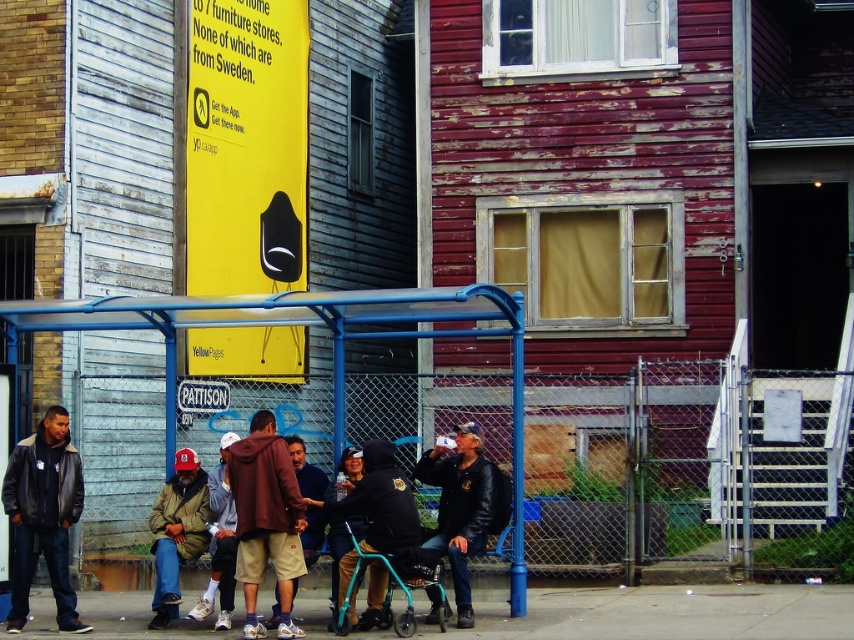
You are standing on the concrete pavement at lower center and want to pick up the denim jacket at lower left. Which direction should you move to reach it?

The denim jacket at lower left is on the left side of the concrete pavement at lower center, so you should move to your left to reach it.